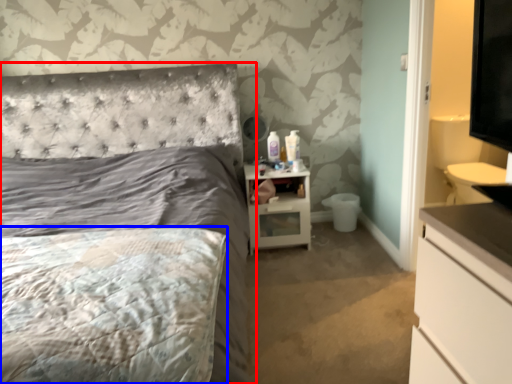
Question: Which of the following is the closest to the observer, bed (highlighted by a red box) or mattress (highlighted by a blue box)?

Choices:
 (A) bed
 (B) mattress

Answer: (A)